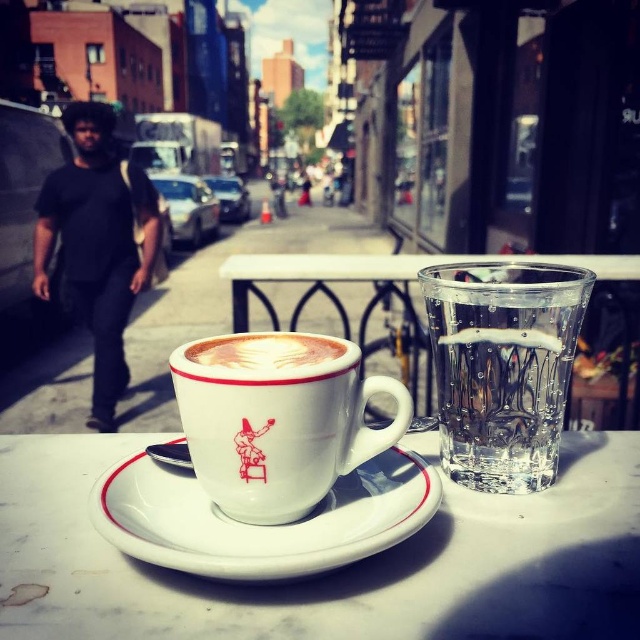
Does white ceramic mug at center have a larger size compared to clear glass water at upper right?

No, white ceramic mug at center is not bigger than clear glass water at upper right.

Which of these two, white ceramic mug at center or clear glass water at upper right, stands shorter?

white ceramic mug at center is shorter.

Does point (184, 413) come farther from viewer compared to point (436, 356)?

That is False.

Where is `white ceramic mug at center`? white ceramic mug at center is located at coordinates (276, 419).

Looking at this image, does white ceramic saucer at center have a lesser width compared to black cotton shirt at left?

Incorrect, white ceramic saucer at center's width is not less than black cotton shirt at left's.

Find the location of a particular element. This screenshot has width=640, height=640. white ceramic saucer at center is located at coordinates (260, 525).

What do you see at coordinates (260, 525) in the screenshot?
I see `white ceramic saucer at center` at bounding box center [260, 525].

Locate an element on the screen. The image size is (640, 640). white ceramic saucer at center is located at coordinates (260, 525).

Is the position of white glossy table at center more distant than that of cappuccino foam at center?

That is True.

From the picture: Does white glossy table at center come in front of cappuccino foam at center?

No.

Which is behind, point (266, 269) or point (205, 364)?

The point (266, 269) is behind.

Image resolution: width=640 pixels, height=640 pixels. What are the coordinates of `white glossy table at center` in the screenshot? It's located at (371, 276).